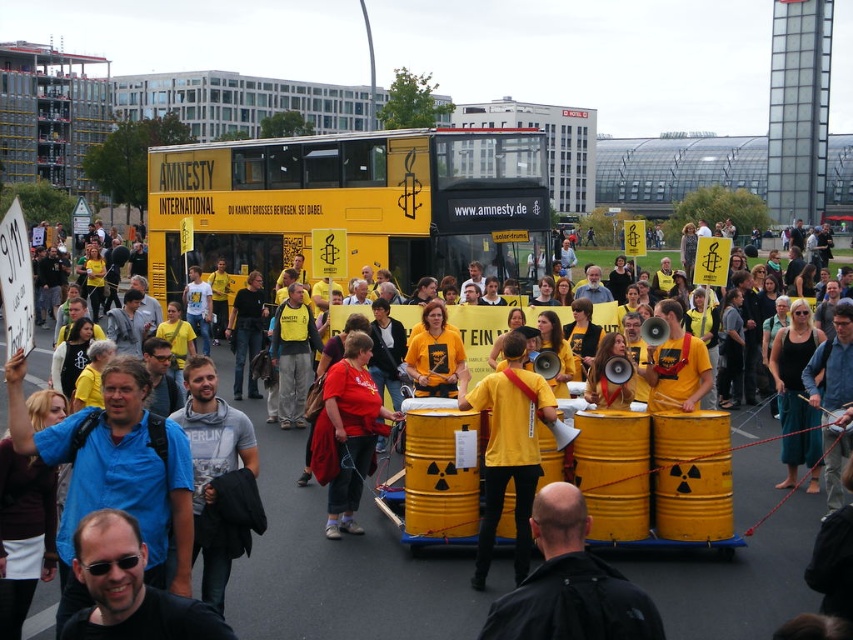
Can you confirm if yellow matte double-decker bus at center is positioned to the left of yellow/yellowish fabric shirt at center?

Indeed, yellow matte double-decker bus at center is positioned on the left side of yellow/yellowish fabric shirt at center.

What do you see at coordinates (351, 202) in the screenshot? I see `yellow matte double-decker bus at center` at bounding box center [351, 202].

Identify the location of yellow matte double-decker bus at center. This screenshot has height=640, width=853. (351, 202).

Does blue cotton shirt at center have a lesser width compared to yellow/yellowish fabric shirt at center?

No.

Does point (13, 445) lie behind point (294, 420)?

No, (13, 445) is in front of (294, 420).

You are a GUI agent. You are given a task and a screenshot of the screen. Output one action in this format:
    pyautogui.click(x=<x>, y=<y>)
    Task: Click on the blue cotton shirt at center
    Image resolution: width=853 pixels, height=640 pixels.
    Given the screenshot: What is the action you would take?
    pyautogui.click(x=114, y=472)

Can you confirm if yellow matte double-decker bus at center is thinner than blue cotton shirt at center?

Incorrect, yellow matte double-decker bus at center's width is not less than blue cotton shirt at center's.

Which is above, yellow matte double-decker bus at center or blue cotton shirt at center?

yellow matte double-decker bus at center is above.

Who is more distant from viewer, (488, 244) or (67, 556)?

The point (488, 244) is more distant.

Locate an element on the screen. The width and height of the screenshot is (853, 640). yellow matte double-decker bus at center is located at coordinates (351, 202).